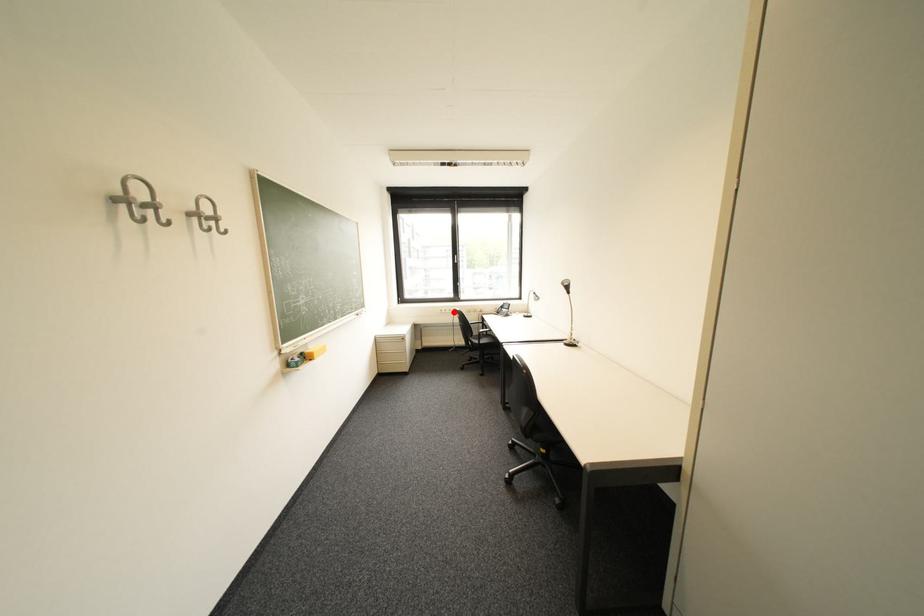
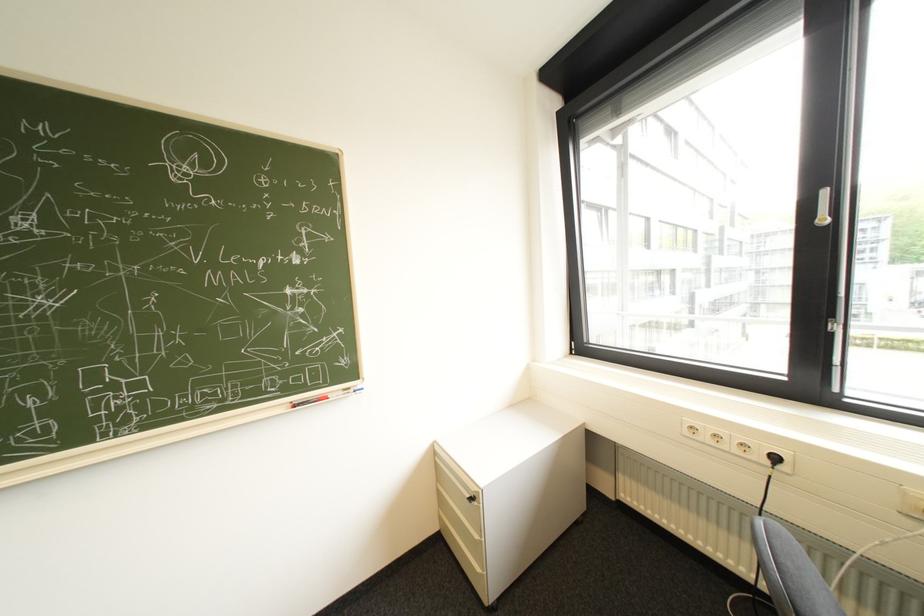
Find the pixel in the second image that matches the highlighted location in the first image.

(715, 438)